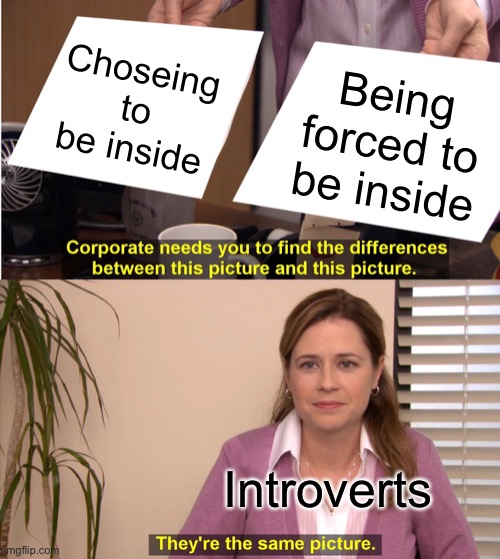
At what (x,y) coordinates should I click in order to perform the action: click on window shade. Please return your answer as a coordinate pair (x, y). This screenshot has height=559, width=500. Looking at the image, I should click on (442, 377).